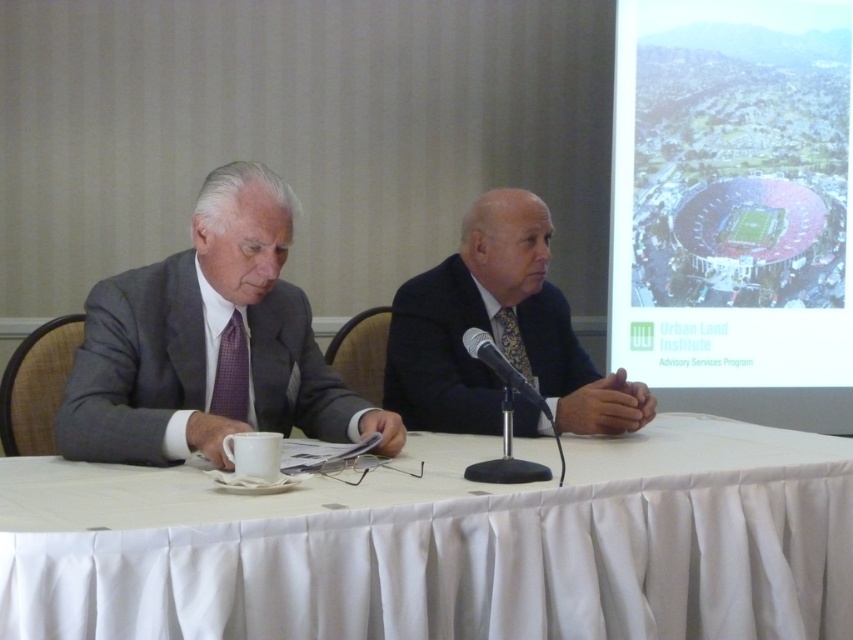
Question: Which object is positioned farthest from the plaid fabric tie at left?

Choices:
 (A) white cloth at center
 (B) black metallic microphone at center
 (C) gray textured suit at left
 (D) dark blue suit at center

Answer: (D)

Question: Which of the following is the closest to the observer?

Choices:
 (A) patterned silk tie at center
 (B) gray textured suit at left
 (C) plaid fabric tie at left

Answer: (B)

Question: Which of the following is the farthest from the observer?

Choices:
 (A) black metallic microphone at center
 (B) gray textured suit at left

Answer: (B)

Question: Does white cloth at center appear over gray textured suit at left?

Choices:
 (A) yes
 (B) no

Answer: (B)

Question: Does white cloth at center have a lesser width compared to plaid fabric tie at left?

Choices:
 (A) yes
 (B) no

Answer: (B)

Question: In this image, where is white cloth at center located relative to patterned silk tie at center?

Choices:
 (A) left
 (B) right

Answer: (A)